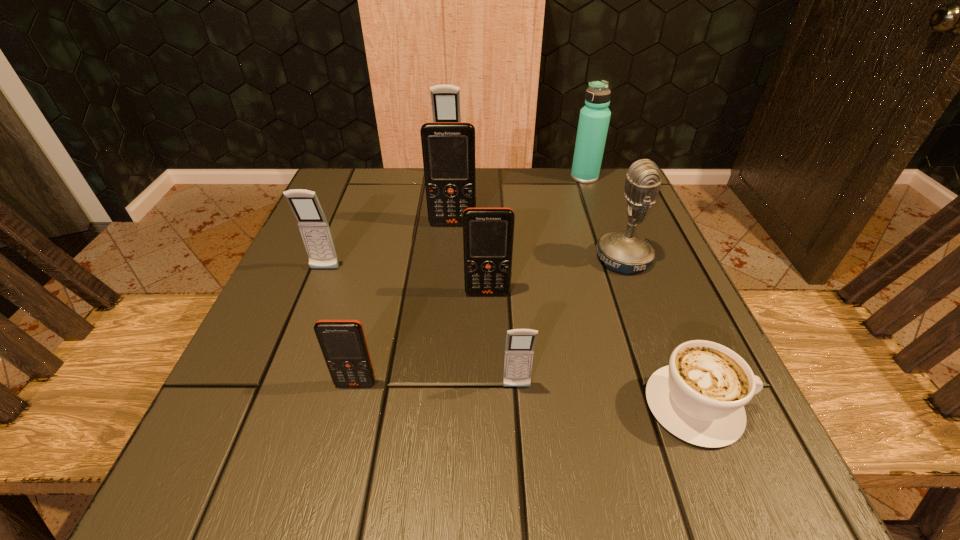
What are the coordinates of `aqua thermos bottle` in the screenshot? It's located at (594, 118).

Locate an element on the screen. The width and height of the screenshot is (960, 540). the farthest gray cellular telephone is located at coordinates (445, 99).

The image size is (960, 540). In order to click on the farthest cellular telephone in this screenshot , I will do `click(445, 99)`.

At what (x,y) coordinates should I click in order to perform the action: click on the second farthest cellular telephone. Please return your answer as a coordinate pair (x, y). Looking at the image, I should click on (448, 148).

At what (x,y) coordinates should I click in order to perform the action: click on the farthest orange cellular telephone. Please return your answer as a coordinate pair (x, y). The image size is (960, 540). Looking at the image, I should click on (448, 148).

At what (x,y) coordinates should I click in order to perform the action: click on microphone. Please return your answer as a coordinate pair (x, y). Looking at the image, I should click on 623,251.

Locate an element on the screen. the leftmost gray cellular telephone is located at coordinates (313, 225).

Locate an element on the screen. the second biggest gray cellular telephone is located at coordinates (313, 225).

You are a GUI agent. You are given a task and a screenshot of the screen. Output one action in this format:
    pyautogui.click(x=<x>, y=<y>)
    Task: Click on the second nearest orange cellular telephone
    The width and height of the screenshot is (960, 540).
    Given the screenshot: What is the action you would take?
    pyautogui.click(x=488, y=233)

Locate an element on the screen. Image resolution: width=960 pixels, height=540 pixels. the second biggest orange cellular telephone is located at coordinates (488, 233).